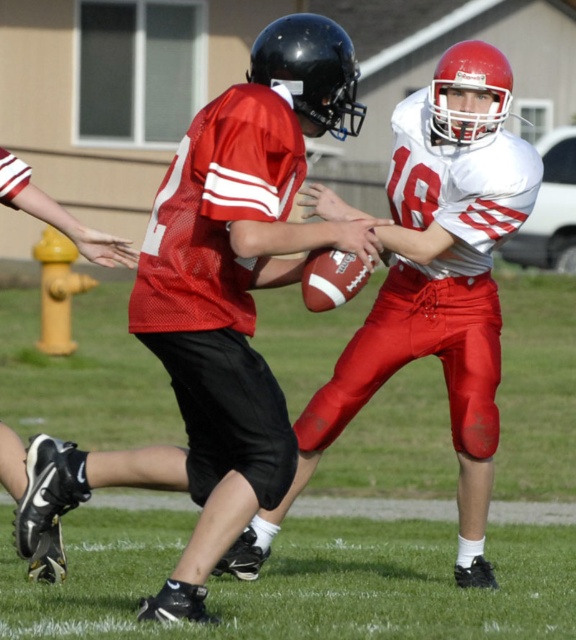
Question: Does matte red football at center lie in front of matte white jersey at center?

Choices:
 (A) no
 (B) yes

Answer: (B)

Question: Observing the image, what is the correct spatial positioning of matte red football at center in reference to matte white jersey at center?

Choices:
 (A) below
 (B) above

Answer: (B)

Question: Which of the following is the closest to the observer?

Choices:
 (A) matte white jersey at center
 (B) matte red football at center

Answer: (B)

Question: Which object is the closest to the green grass football field at center?

Choices:
 (A) matte red football at center
 (B) matte white jersey at center

Answer: (B)

Question: Among these objects, which one is nearest to the camera?

Choices:
 (A) matte red football at center
 (B) green grass football field at center

Answer: (A)

Question: Can you confirm if green grass football field at center is wider than matte red football at center?

Choices:
 (A) yes
 (B) no

Answer: (A)